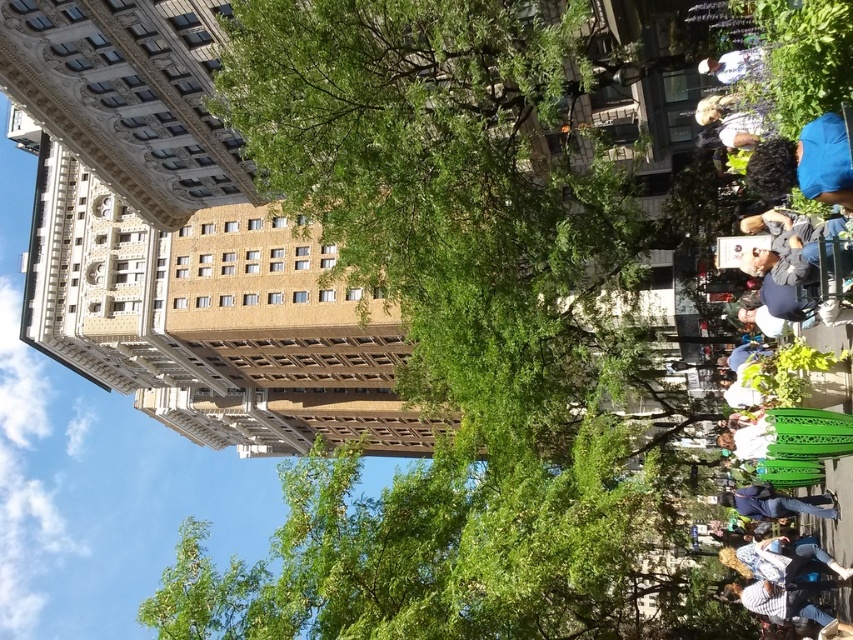
Question: Does blue fabric at upper right have a lesser width compared to white fabric shirt at upper right?

Choices:
 (A) yes
 (B) no

Answer: (B)

Question: Based on their relative distances, which object is farther from the denim jacket at lower right?

Choices:
 (A) blonde hair at upper right
 (B) white fabric shirt at upper right
 (C) blue fabric at upper right

Answer: (B)

Question: Is green leafy tree at center to the left of white fabric shirt at upper right from the viewer's perspective?

Choices:
 (A) yes
 (B) no

Answer: (A)

Question: Which object is farther from the camera taking this photo?

Choices:
 (A) green leafy tree at center
 (B) blonde hair at upper right
 (C) denim jacket at lower right
 (D) blue fabric at upper right

Answer: (B)

Question: Is green leafy tree at center further to the viewer compared to denim jacket at lower right?

Choices:
 (A) no
 (B) yes

Answer: (A)

Question: Which is nearer to the blonde hair at upper right?

Choices:
 (A) green leafy tree at center
 (B) blue fabric at upper right
 (C) white fabric shirt at upper right

Answer: (C)